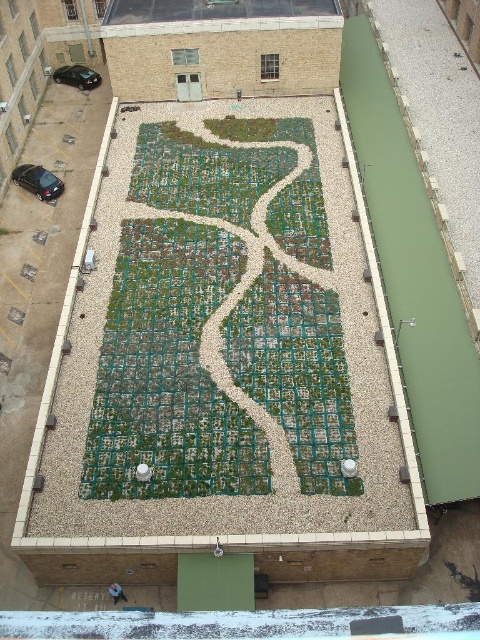
Question: Does green textured maze at center have a larger size compared to green textured tiles at upper center?

Choices:
 (A) yes
 (B) no

Answer: (A)

Question: Does glossy black car at lower left appear over shiny black car at upper left?

Choices:
 (A) no
 (B) yes

Answer: (A)

Question: Can you confirm if green textured tiles at upper center is positioned to the left of shiny black car at upper left?

Choices:
 (A) yes
 (B) no

Answer: (B)

Question: Which object appears farthest from the camera in this image?

Choices:
 (A) green textured tiles at upper center
 (B) shiny black car at upper left
 (C) glossy black car at lower left
 (D) green textured maze at center

Answer: (B)

Question: Estimate the real-world distances between objects in this image. Which object is farther from the green textured maze at center?

Choices:
 (A) green textured tiles at upper center
 (B) glossy black car at lower left

Answer: (B)

Question: Which point appears farthest from the camera in this image?

Choices:
 (A) (45, 189)
 (B) (158, 20)

Answer: (A)